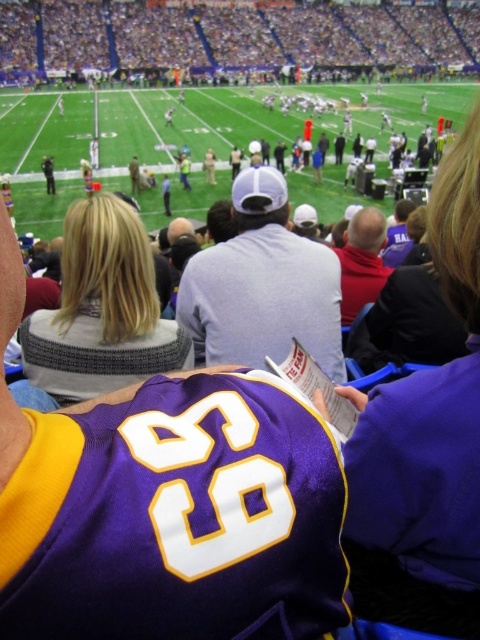
You are a photographer standing at the edge of the field. You want to take a photo of the red matte shirt at center without the gray cotton baseball cap at center blocking it. Is it possible to adjust your position to achieve this?

The gray cotton baseball cap at center is currently in front of the red matte shirt at center. By moving to a position where the photographer can angle the camera around or above the cap, it might be possible to capture the shirt without obstruction.

You are a photographer standing at the edge of the football field. You want to take a photo that includes both the gray cotton baseball cap at center and the red matte shirt at center. What is the minimum distance you need to move backward to ensure both objects are fully visible in your camera frame?

The minimum distance you need to move backward is 21.10 feet to ensure both the gray cotton baseball cap at center and the red matte shirt at center are fully visible in your camera frame.

You are a photographer standing at the edge of the football field. You notice two items at the center of your viewfinder, the gray cotton baseball cap at center and the red matte shirt at center. Which item appears taller in your view?

The gray cotton baseball cap at center is taller than the red matte shirt at center, so it appears taller in the viewfinder.